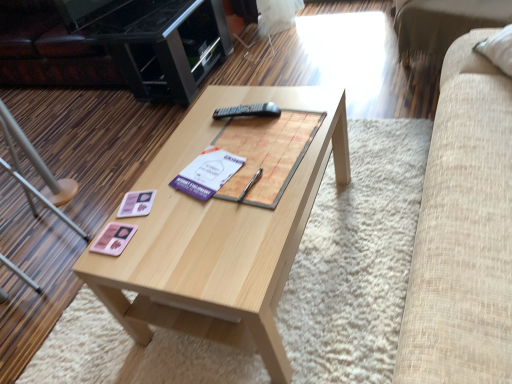
Image resolution: width=512 pixels, height=384 pixels. I want to click on vacant space to the right of pink matte card game at center, so click(x=169, y=232).